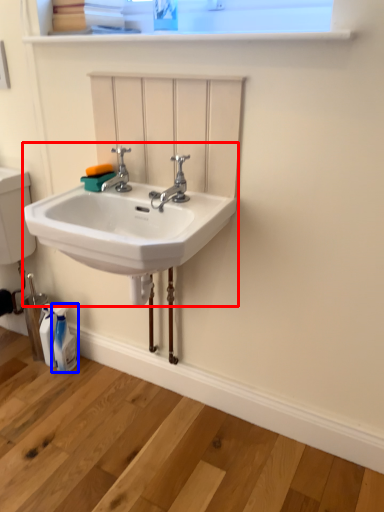
Question: Which object appears farthest to the camera in this image, sink (highlighted by a red box) or toiletry (highlighted by a blue box)?

Choices:
 (A) sink
 (B) toiletry

Answer: (B)